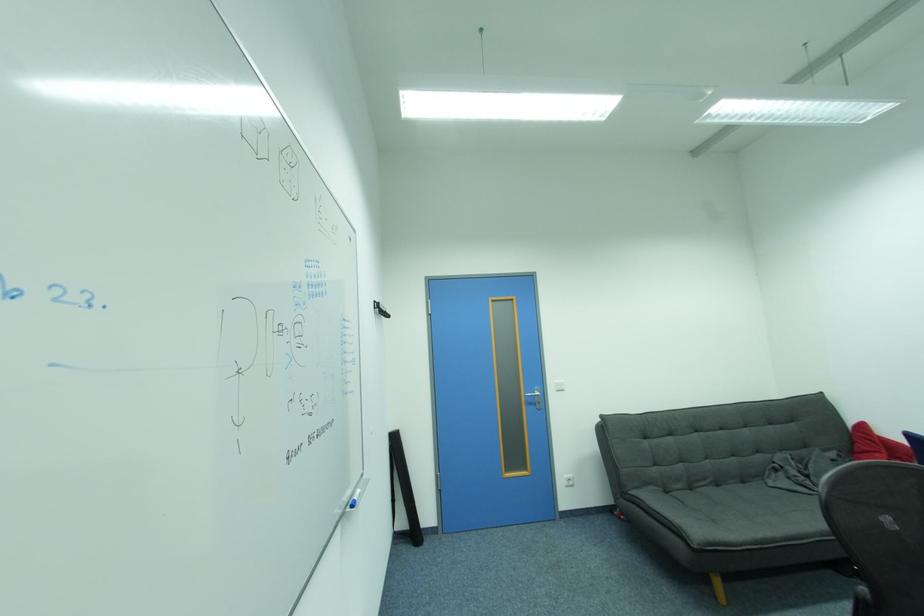
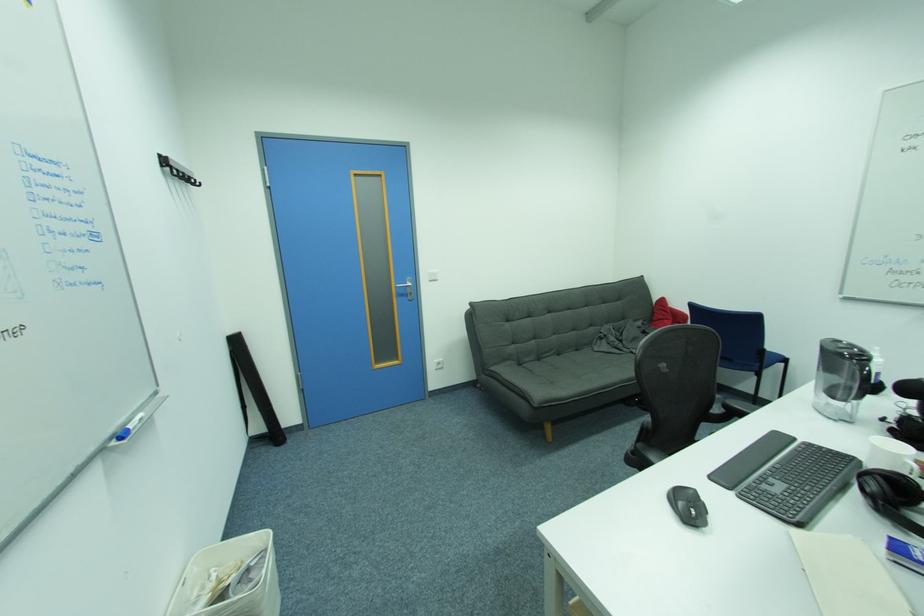
From the picture: First-person continuous shooting, in which direction is the camera rotating?

The rotation direction of the camera is right-down.